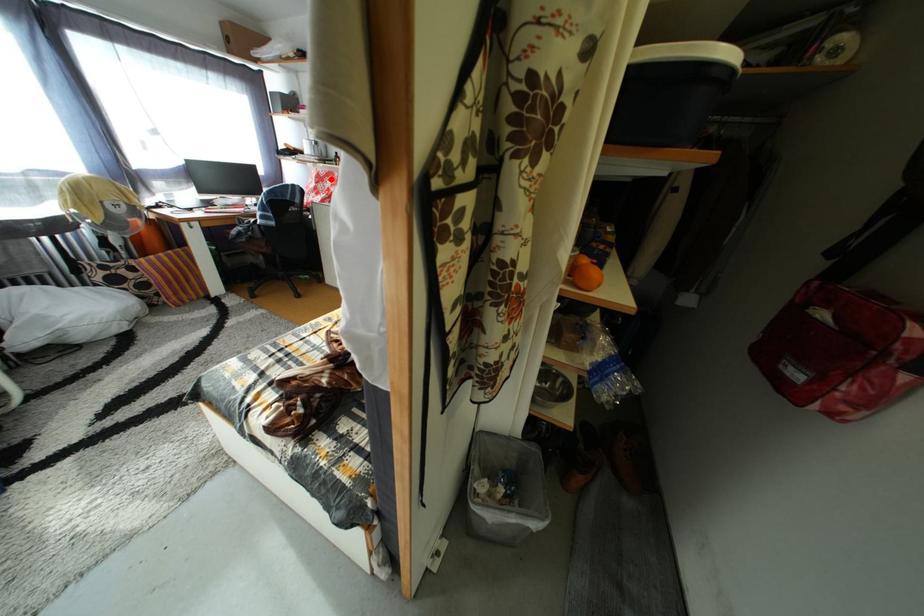
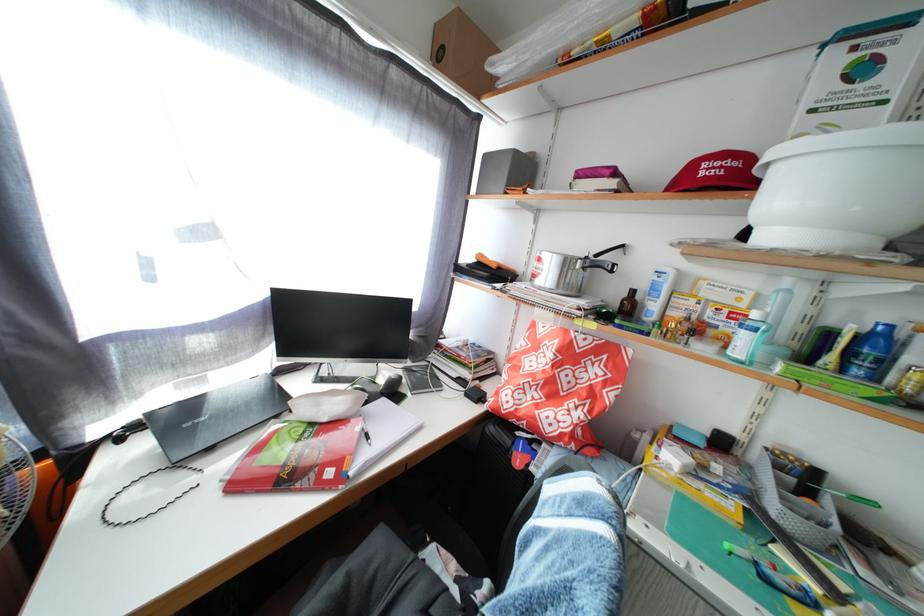
Question: I am providing you with two images of the same scene from different viewpoints. A red point is shown in image1. For the corresponding object point in image2, is it positioned nearer or farther from the camera?

Choices:
 (A) Nearer
 (B) Farther

Answer: (B)